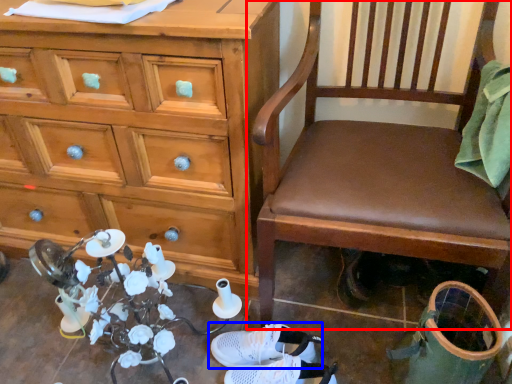
Question: Among these objects, which one is nearest to the camera, chair (highlighted by a red box) or footwear (highlighted by a blue box)?

Choices:
 (A) chair
 (B) footwear

Answer: (A)